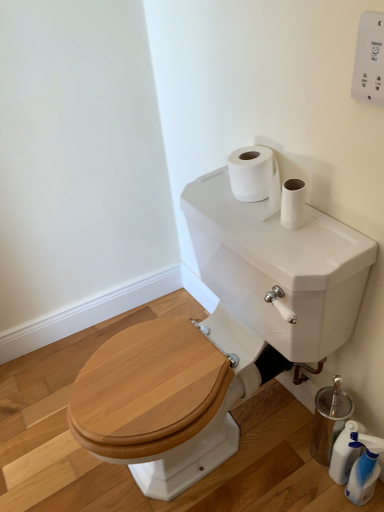
Locate an element on the screen. This screenshot has height=512, width=384. vacant space to the left of translucent plastic spray bottle at lower right, which is the 1th cleaning product in front-to-back order is located at coordinates (293, 484).